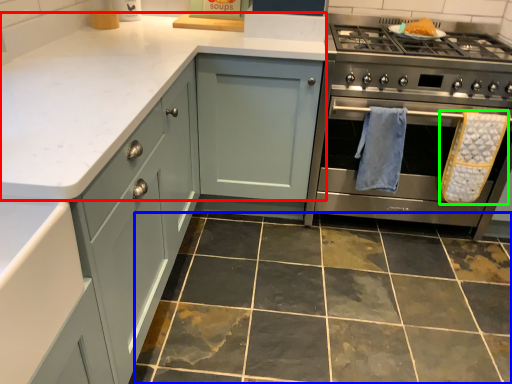
Question: Based on their relative distances, which object is nearer to counter top (highlighted by a red box)? Choose from ceramic tile (highlighted by a blue box) and bath towel (highlighted by a green box).

Choices:
 (A) ceramic tile
 (B) bath towel

Answer: (A)